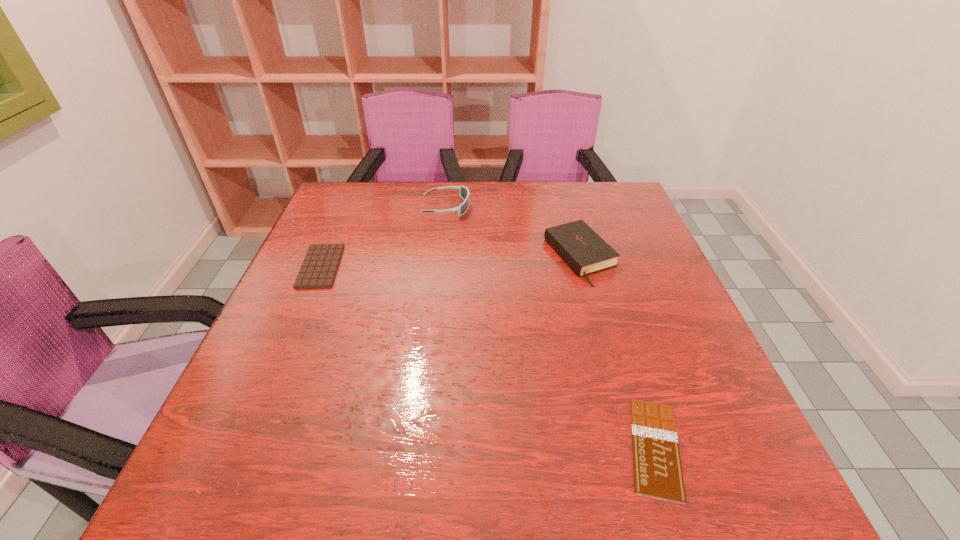
What are the coordinates of `free location located on the left of the shorter chocolate bar` in the screenshot? It's located at point(569,447).

The image size is (960, 540). In order to click on object present at the far edge in this screenshot , I will do `click(464, 193)`.

Locate an element on the screen. This screenshot has width=960, height=540. object present at the near edge is located at coordinates click(657, 466).

This screenshot has width=960, height=540. I want to click on object that is positioned at the left edge, so click(320, 265).

Find the location of `Bible positioned at the right edge`. Bible positioned at the right edge is located at coordinates (580, 247).

Where is `chocolate bar that is at the right edge`? chocolate bar that is at the right edge is located at coordinates (657, 466).

Identify the location of object present at the near right corner. (657, 466).

You are a GUI agent. You are given a task and a screenshot of the screen. Output one action in this format:
    pyautogui.click(x=<x>, y=<y>)
    Task: Click on the free space at the far edge of the desktop
    
    Given the screenshot: What is the action you would take?
    pyautogui.click(x=568, y=199)

Image resolution: width=960 pixels, height=540 pixels. In the image, there is a desktop. In order to click on vacant space at the left edge in this screenshot , I will do `click(286, 335)`.

In the image, there is a desktop. Identify the location of vacant space at the right edge. (714, 420).